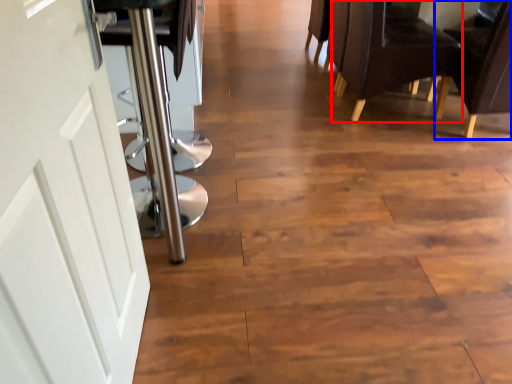
Question: Which object is closer to the camera taking this photo, chair (highlighted by a red box) or chair (highlighted by a blue box)?

Choices:
 (A) chair
 (B) chair

Answer: (B)